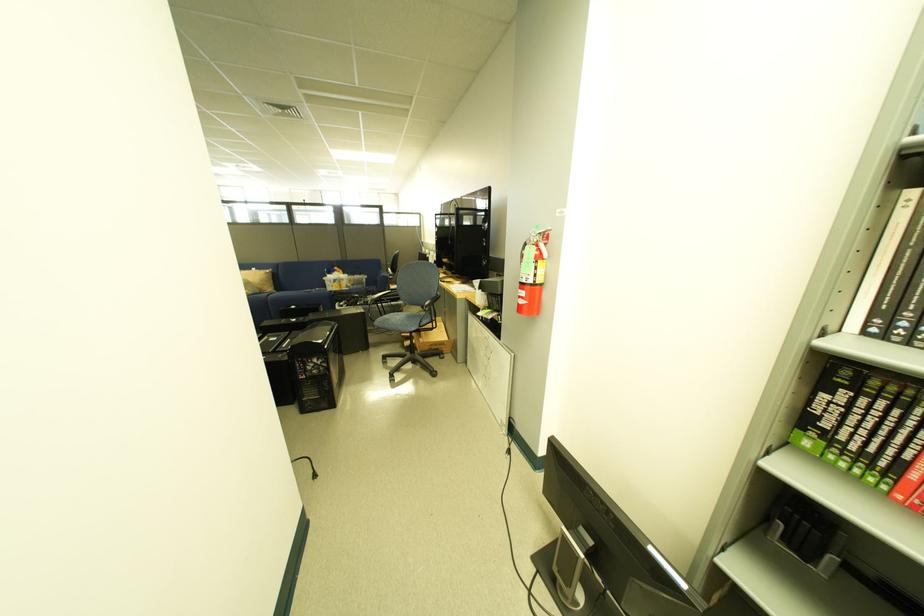
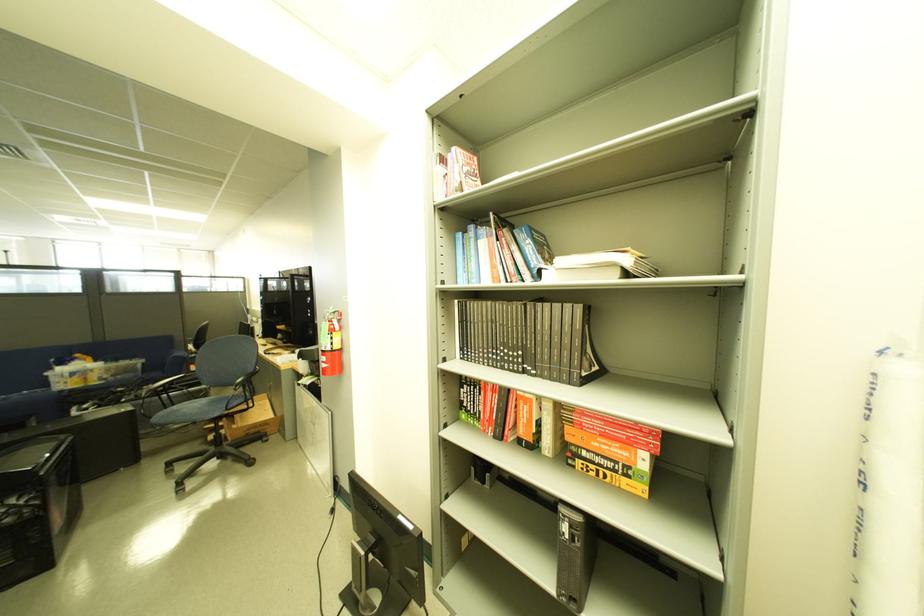
Where in the second image is the point corresponding to point (494, 268) from the first image?

(322, 336)